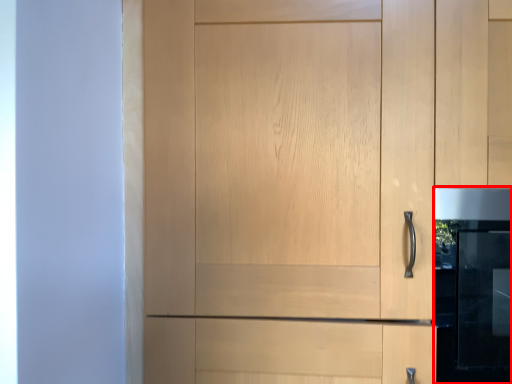
Question: Observing the image, what is the correct spatial positioning of oven (annotated by the red box) in reference to cupboard?

Choices:
 (A) right
 (B) left

Answer: (A)